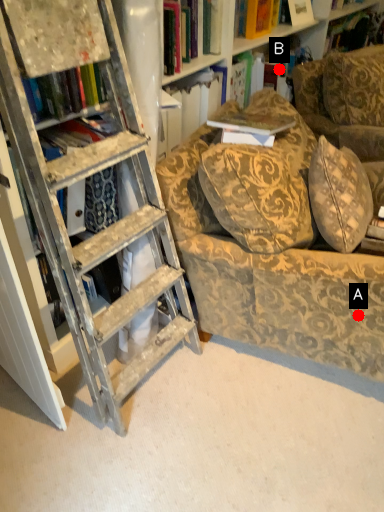
Question: Two points are circled on the image, labeled by A and B beside each circle. Which point appears closest to the camera in this image?

Choices:
 (A) A is closer
 (B) B is closer

Answer: (A)